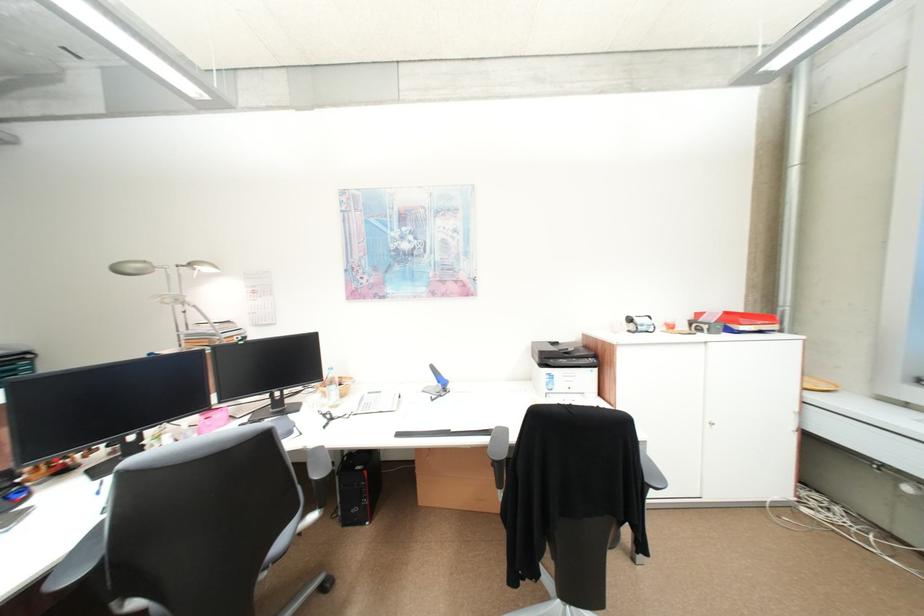
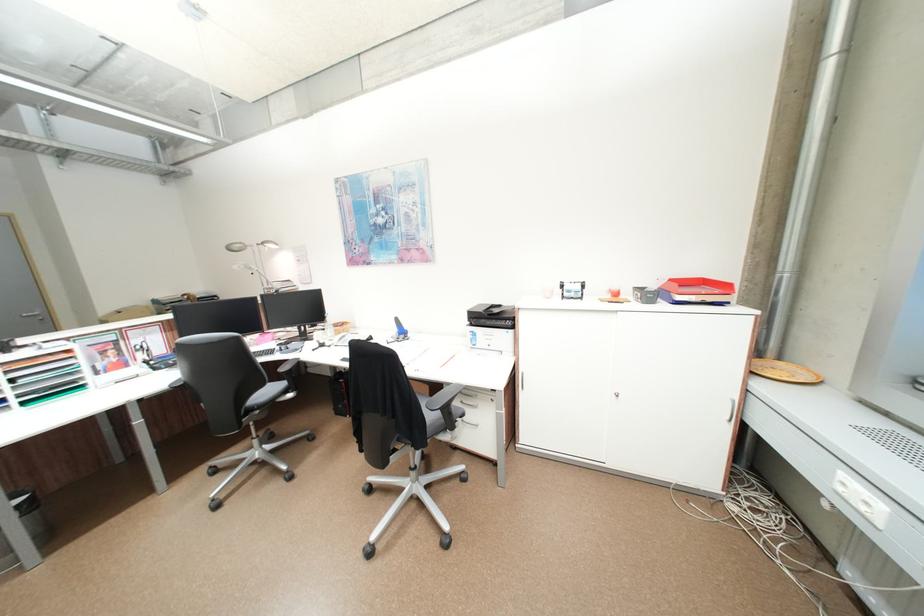
Where in the second image is the point corresponding to point 140,272 from the first image?

(245, 249)